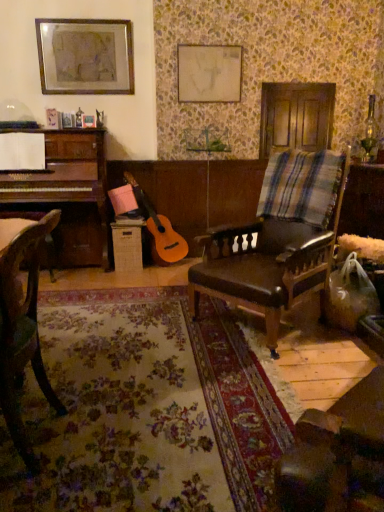
Where is `free space above matte white canvas at upper center, the 2th picture frame when ordered from left to right (from a real-world perspective)`? This screenshot has width=384, height=512. free space above matte white canvas at upper center, the 2th picture frame when ordered from left to right (from a real-world perspective) is located at coordinates (218, 42).